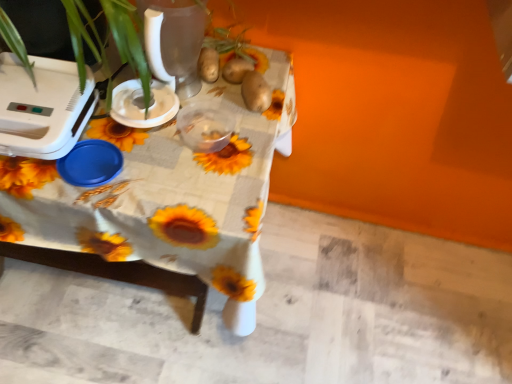
Question: Can you confirm if sunflower-patterned fabric at center is thinner than brown matte potato at upper center, which ranks as the first potato in left-to-right order?

Choices:
 (A) yes
 (B) no

Answer: (B)

Question: Can you see sunflower-patterned fabric at center touching brown matte potato at upper center, which appears as the second potato when viewed from the right?

Choices:
 (A) no
 (B) yes

Answer: (A)

Question: Does sunflower-patterned fabric at center turn towards brown matte potato at upper center, which ranks as the first potato in left-to-right order?

Choices:
 (A) yes
 (B) no

Answer: (B)

Question: Is sunflower-patterned fabric at center located outside brown matte potato at upper center, which ranks as the first potato in left-to-right order?

Choices:
 (A) yes
 (B) no

Answer: (A)

Question: Is sunflower-patterned fabric at center wider than brown matte potato at upper center, which ranks as the first potato in left-to-right order?

Choices:
 (A) yes
 (B) no

Answer: (A)

Question: From a real-world perspective, is white plastic appliance at left, the first appliance from the left, above or below brown matte potato at upper center, which ranks as the first potato in left-to-right order?

Choices:
 (A) above
 (B) below

Answer: (A)

Question: Considering the relative positions of white plastic appliance at left, the first appliance from the left, and brown matte potato at upper center, which appears as the second potato when viewed from the right, in the image provided, is white plastic appliance at left, the first appliance from the left, to the left or to the right of brown matte potato at upper center, which appears as the second potato when viewed from the right,?

Choices:
 (A) right
 (B) left

Answer: (B)

Question: Based on their sizes in the image, would you say white plastic appliance at left, the first appliance from the left, is bigger or smaller than brown matte potato at upper center, which appears as the second potato when viewed from the right?

Choices:
 (A) big
 (B) small

Answer: (A)

Question: In terms of width, does white plastic appliance at left, the first appliance from the left, look wider or thinner when compared to brown matte potato at upper center, which ranks as the first potato in left-to-right order?

Choices:
 (A) wide
 (B) thin

Answer: (A)

Question: From a real-world perspective, is brown matte potato at upper center, which ranks as the first potato in left-to-right order, positioned above or below white plastic appliance at left, the first appliance from the left?

Choices:
 (A) above
 (B) below

Answer: (B)

Question: Relative to white plastic appliance at left, the 2th appliance when ordered from right to left, is brown matte potato at upper center, which ranks as the first potato in left-to-right order, in front or behind?

Choices:
 (A) behind
 (B) front

Answer: (A)

Question: Does point (208, 66) appear closer or farther from the camera than point (73, 144)?

Choices:
 (A) closer
 (B) farther

Answer: (B)

Question: Looking at their shapes, would you say brown matte potato at upper center, which ranks as the first potato in left-to-right order, is wider or thinner than white plastic appliance at left, the first appliance from the left?

Choices:
 (A) wide
 (B) thin

Answer: (B)

Question: Is brown matte potato at upper center in front of or behind brown matte potato at center, acting as the 1th potato starting from the right, in the image?

Choices:
 (A) behind
 (B) front

Answer: (A)

Question: Looking at their shapes, would you say brown matte potato at upper center is wider or thinner than brown matte potato at center, acting as the 1th potato starting from the right?

Choices:
 (A) thin
 (B) wide

Answer: (A)